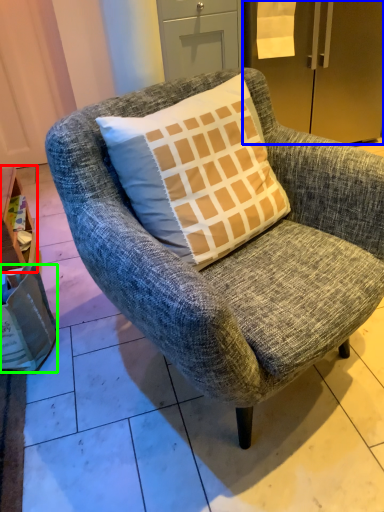
Question: Estimate the real-world distances between objects in this image. Which object is closer to table (highlighted by a red box), refrigerator (highlighted by a blue box) or box (highlighted by a green box)?

Choices:
 (A) refrigerator
 (B) box

Answer: (B)